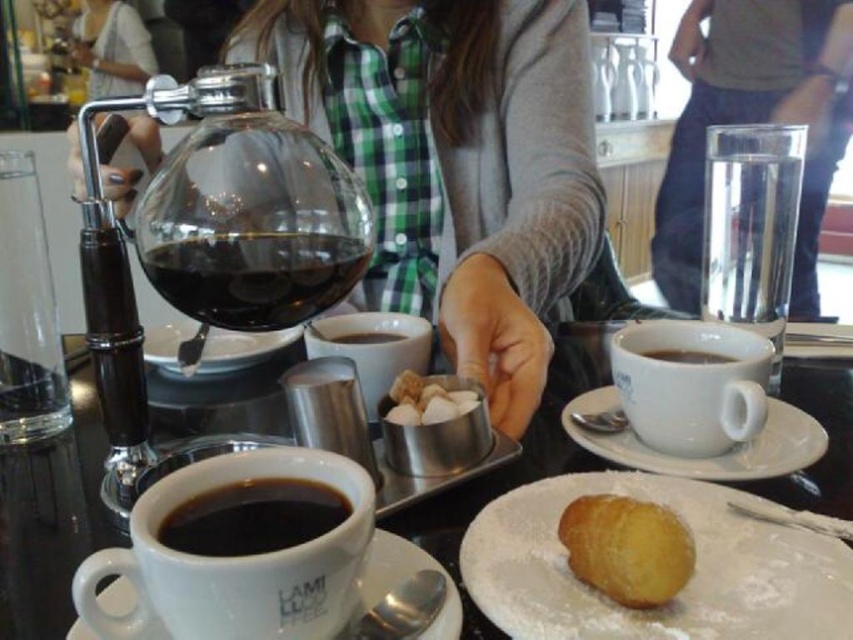
Question: Which object is farther from the camera taking this photo?

Choices:
 (A) transparent glass carafe at center
 (B) white ceramic saucer at right
 (C) metallic silver sugar bowl at center

Answer: (C)

Question: Does white ceramic saucer at lower center appear on the left side of matte white cup at center?

Choices:
 (A) no
 (B) yes

Answer: (B)

Question: Which of the following is the farthest from the observer?

Choices:
 (A) (630, 572)
 (B) (222, 554)
 (C) (277, 337)

Answer: (C)

Question: Can you confirm if powdered sugar donut at lower right is smaller than powdery golden donut at lower center?

Choices:
 (A) yes
 (B) no

Answer: (B)

Question: Can you confirm if white ceramic saucer at right is wider than white ceramic saucer at lower center?

Choices:
 (A) yes
 (B) no

Answer: (B)

Question: Which point appears farthest from the camera in this image?

Choices:
 (A) (343, 282)
 (B) (502, 528)
 (C) (701, 355)
 (D) (405, 424)

Answer: (C)